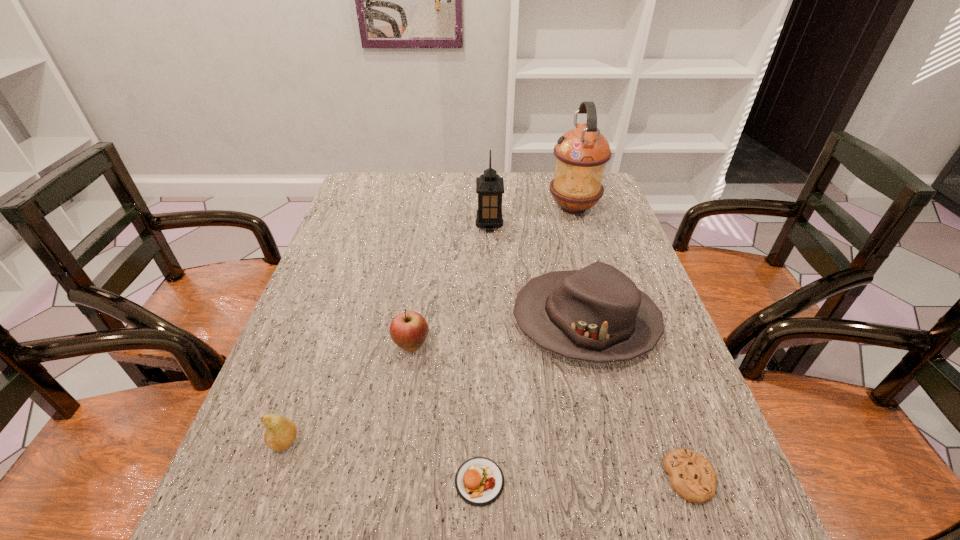
Locate an element on the screen. This screenshot has width=960, height=540. unoccupied area between the fifth shortest object and the lantern is located at coordinates pyautogui.click(x=538, y=274).

I want to click on vacant space that is in between the second tallest object and the tallest object, so (x=532, y=217).

Where is `free space between the pear and the oil lamp`? free space between the pear and the oil lamp is located at coordinates (429, 325).

This screenshot has width=960, height=540. I want to click on free spot between the second object from left to right and the pear, so pyautogui.click(x=348, y=393).

Identify the location of vacant region between the apple and the hat. Image resolution: width=960 pixels, height=540 pixels. (498, 333).

You are a GUI agent. You are given a task and a screenshot of the screen. Output one action in this format:
    pyautogui.click(x=<x>, y=<y>)
    Task: Click on the free spot between the fifth shortest object and the cookie
    
    Given the screenshot: What is the action you would take?
    pyautogui.click(x=637, y=400)

The width and height of the screenshot is (960, 540). What are the coordinates of `free space that is in between the patty (food) and the apple` in the screenshot? It's located at (445, 414).

Locate an element on the screen. The image size is (960, 540). free space between the cookie and the third tallest object is located at coordinates (637, 400).

Identify the location of the second closest object relative to the oil lamp. (597, 314).

Identify which object is the closest to the apple. Please provide its 2D coordinates. Your answer should be formatted as a tuple, i.e. [(x, y)], where the tuple contains the x and y coordinates of a point satisfying the conditions above.

[(597, 314)]